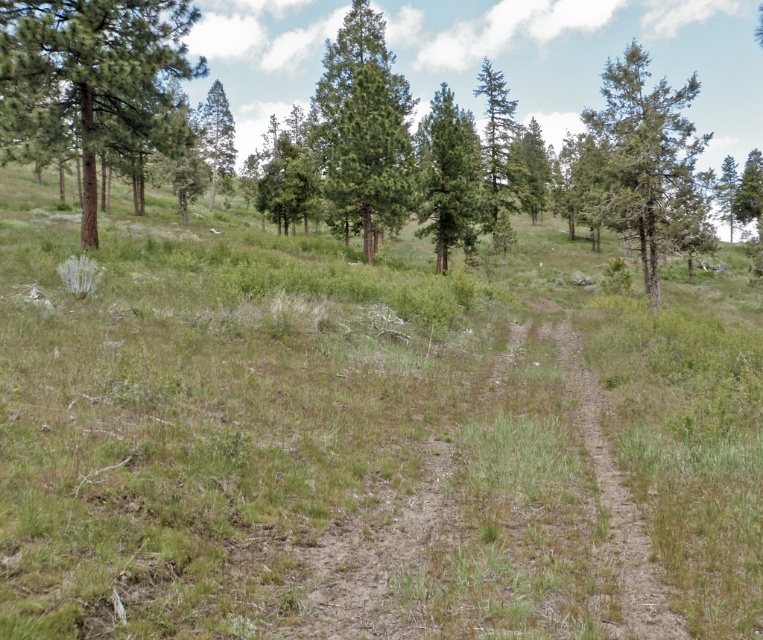
Question: Where is brown dirt track at center located in relation to green textured pine tree at center in the image?

Choices:
 (A) above
 (B) below

Answer: (B)

Question: Observing the image, what is the correct spatial positioning of green matte tree at upper left in reference to green textured pine at center?

Choices:
 (A) left
 (B) right

Answer: (A)

Question: Which object is closer to the camera taking this photo?

Choices:
 (A) green textured pine at center
 (B) green matte tree at center
 (C) green textured pine at right

Answer: (C)

Question: Which of the following is the farthest from the observer?

Choices:
 (A) (216, 164)
 (B) (81, 76)

Answer: (A)

Question: In this image, where is green textured pine at center located relative to dirt path at center?

Choices:
 (A) below
 (B) above

Answer: (B)

Question: Among these points, which one is nearest to the camera?

Choices:
 (A) (475, 145)
 (B) (675, 154)
 (C) (671, 628)

Answer: (C)